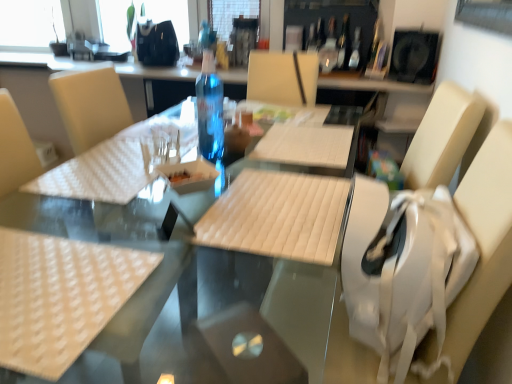
Based on the photo, what is the approximate width of white quilted placemat at center?

The width of white quilted placemat at center is 36.48 inches.

What is the approximate width of white quilted fabric at center?

white quilted fabric at center is 34.70 centimeters in width.

This screenshot has width=512, height=384. In order to click on transparent plastic bottle at center, the second bottle positioned from the right in this screenshot , I will do `click(344, 43)`.

What do you see at coordinates (484, 242) in the screenshot?
I see `white fabric swivel chair at right` at bounding box center [484, 242].

The image size is (512, 384). I want to click on white quilted placemat at center, so click(176, 292).

Is transparent plastic bottle at center, positioned as the 2th bottle in left-to-right order, surrounding transparent plastic bottle at upper center, the first bottle viewed from the right?

Definitely not — transparent plastic bottle at upper center, the first bottle viewed from the right, is not inside transparent plastic bottle at center, positioned as the 2th bottle in left-to-right order.

There is a transparent plastic bottle at center, positioned as the 2th bottle in left-to-right order. Where is `the 1st bottle below it (from the image's perspective)`? This screenshot has height=384, width=512. the 1st bottle below it (from the image's perspective) is located at coordinates (355, 50).

Between transparent plastic bottle at center, the second bottle positioned from the right, and transparent plastic bottle at upper center, the first bottle viewed from the right, which one has smaller size?

Smaller between the two is transparent plastic bottle at upper center, the first bottle viewed from the right.

Based on the photo, does transparent plastic bottle at center, the second bottle positioned from the right, have a lesser width compared to transparent plastic bottle at upper center, which ranks as the 2th bottle in top-to-bottom order?

Incorrect, the width of transparent plastic bottle at center, the second bottle positioned from the right, is not less than that of transparent plastic bottle at upper center, which ranks as the 2th bottle in top-to-bottom order.

The width and height of the screenshot is (512, 384). Find the location of `wine bottle above the white quilted fabric at center (from a real-world perspective)`. wine bottle above the white quilted fabric at center (from a real-world perspective) is located at coordinates (329, 49).

From their relative heights in the image, would you say translucent glass wine bottle at upper center is taller or shorter than white quilted fabric at center?

Clearly, translucent glass wine bottle at upper center is taller compared to white quilted fabric at center.

Between translucent glass wine bottle at upper center and white quilted fabric at center, which one has smaller size?

With smaller size is translucent glass wine bottle at upper center.

From the image's perspective, which is below, translucent glass wine bottle at upper center or white quilted fabric at center?

white quilted fabric at center.

Is beige quilted placemat at lower left directly adjacent to transparent glass window at upper left?

No, beige quilted placemat at lower left is not in contact with transparent glass window at upper left.

Where is `window above the beige quilted placemat at lower left (from a real-world perspective)`? Image resolution: width=512 pixels, height=384 pixels. window above the beige quilted placemat at lower left (from a real-world perspective) is located at coordinates (30, 24).

From a real-world perspective, which object stands above the other?

From a 3D spatial view, transparent glass window at upper left is above.

Between point (85, 255) and point (44, 0), which one is positioned behind?

Positioned behind is point (44, 0).

Is transparent glass window at upper left inside the boundaries of white quilted fabric at center, or outside?

transparent glass window at upper left cannot be found inside white quilted fabric at center.

From a real-world perspective, is transparent glass window at upper left positioned over white quilted fabric at center based on gravity?

Yes.

Where is `window located above the white quilted fabric at center (from the image's perspective)`? window located above the white quilted fabric at center (from the image's perspective) is located at coordinates (30, 24).

Is point (27, 30) in front of point (232, 239)?

That is False.

In terms of height, does transparent glass window at upper left look taller or shorter compared to translucent glass wine bottle at upper center?

transparent glass window at upper left is taller than translucent glass wine bottle at upper center.

Is transparent glass window at upper left at the left side of translucent glass wine bottle at upper center?

Indeed, transparent glass window at upper left is positioned on the left side of translucent glass wine bottle at upper center.

How far apart are transparent glass window at upper left and translucent glass wine bottle at upper center?

transparent glass window at upper left and translucent glass wine bottle at upper center are 2.33 meters apart.

From a real-world perspective, between transparent glass window at upper left and translucent glass wine bottle at upper center, who is vertically higher?

transparent glass window at upper left, from a real-world perspective.

Is beige quilted placemat at lower left oriented away from transparent plastic bottle at center, which is counted as the first bottle, starting from the top?

No.

From the image's perspective, which one is positioned higher, beige quilted placemat at lower left or transparent plastic bottle at center, marked as the third bottle in a bottom-to-top arrangement?

transparent plastic bottle at center, marked as the third bottle in a bottom-to-top arrangement.

From a real-world perspective, who is located lower, beige quilted placemat at lower left or transparent plastic bottle at center, placed as the third bottle when sorted from front to back?

beige quilted placemat at lower left, from a real-world perspective.

Would you say translucent glass wine bottle at upper center is to the left or to the right of beige quilted placemat at lower left in the picture?

translucent glass wine bottle at upper center is positioned on beige quilted placemat at lower left's right side.

Which is behind, point (333, 65) or point (90, 338)?

The point (333, 65) is farther.

From a real-world perspective, is translucent glass wine bottle at upper center below beige quilted placemat at lower left?

Actually, translucent glass wine bottle at upper center is physically above beige quilted placemat at lower left in the real world.

At what (x,y) coordinates should I click in order to perform the action: click on bottle above the transparent plastic bottle at upper center, positioned as the second bottle in front-to-back order (from the image's perspective). Please return your answer as a coordinate pair (x, y). Image resolution: width=512 pixels, height=384 pixels. Looking at the image, I should click on (344, 43).

At what (x,y) coordinates should I click in order to perform the action: click on plywood below the translucent glass wine bottle at upper center (from the image's perspective). Please return your answer as a coordinate pair (x, y). The height and width of the screenshot is (384, 512). Looking at the image, I should click on (277, 216).

Estimate the real-world distances between objects in this image. Which object is further from beige quilted placemat at lower left, transparent plastic bottle at center, positioned as the 2th bottle in left-to-right order, or white quilted placemat at center?

transparent plastic bottle at center, positioned as the 2th bottle in left-to-right order.

When comparing their distances from transparent plastic bottle at center, marked as the 3th bottle in a right-to-left arrangement, does beige quilted placemat at lower left or white quilted fabric at center seem closer?

white quilted fabric at center is positioned closer to the anchor transparent plastic bottle at center, marked as the 3th bottle in a right-to-left arrangement.

Estimate the real-world distances between objects in this image. Which object is further from white quilted fabric at center, white quilted placemat at center or translucent glass wine bottle at upper center?

translucent glass wine bottle at upper center is further to white quilted fabric at center.

Looking at the image, which one is located closer to transparent plastic bottle at center, marked as the third bottle in a bottom-to-top arrangement, transparent glass window at upper left or white fabric swivel chair at right?

Among the two, white fabric swivel chair at right is located nearer to transparent plastic bottle at center, marked as the third bottle in a bottom-to-top arrangement.

Based on their spatial positions, is beige quilted placemat at lower left or transparent plastic bottle at upper center, the 2th bottle from the bottom, closer to white quilted fabric at center?

beige quilted placemat at lower left is positioned closer to the anchor white quilted fabric at center.

Which object lies nearer to the anchor point beige quilted placemat at lower left, transparent plastic bottle at upper center, the 2th bottle from the bottom, or translucent glass wine bottle at upper center?

translucent glass wine bottle at upper center lies closer to beige quilted placemat at lower left than the other object.

Looking at the image, which one is located further to translucent glass wine bottle at upper center, white quilted fabric at center or transparent plastic bottle at upper center, which ranks as the 2th bottle in top-to-bottom order?

white quilted fabric at center is further to translucent glass wine bottle at upper center.

When comparing their distances from beige quilted placemat at lower left, does white fabric swivel chair at right or transparent glass window at upper left seem further?

Based on the image, transparent glass window at upper left appears to be further to beige quilted placemat at lower left.

Where is `swivel chair between white quilted placemat at center and translucent glass wine bottle at upper center from front to back`? This screenshot has height=384, width=512. swivel chair between white quilted placemat at center and translucent glass wine bottle at upper center from front to back is located at coordinates (484, 242).

Locate an element on the screen. Image resolution: width=512 pixels, height=384 pixels. bottle located between white fabric swivel chair at right and transparent plastic bottle at upper center, the first bottle viewed from the right, in the depth direction is located at coordinates (210, 110).

Find the location of a particular element. The height and width of the screenshot is (384, 512). swivel chair between white quilted placemat at center and transparent plastic bottle at center, the first bottle in the left-to-right sequence, along the z-axis is located at coordinates (484, 242).

What are the coordinates of `swivel chair positioned between beige quilted placemat at lower left and translucent glass wine bottle at upper center from near to far` in the screenshot? It's located at (484, 242).